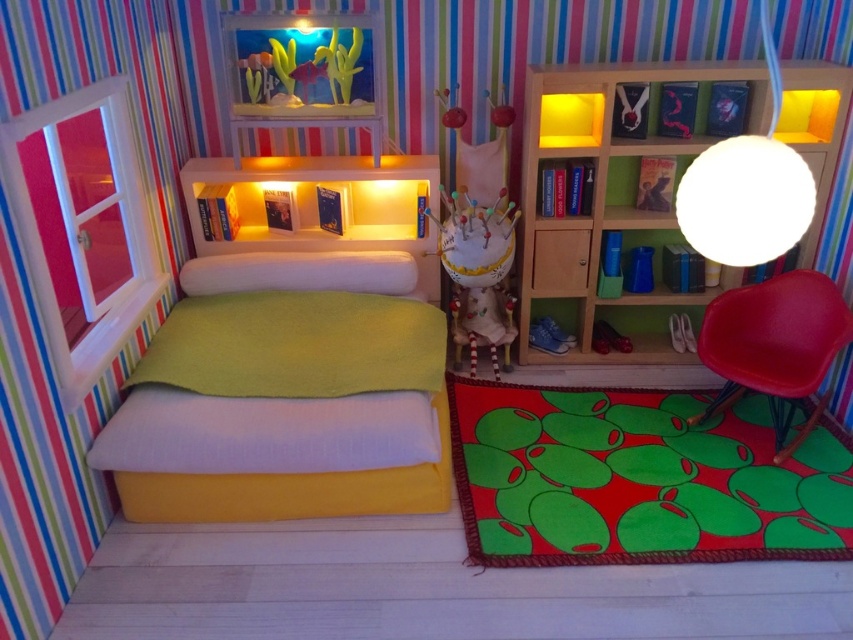
You are a small toy measuring 1.5 meters in length that needs to move from the matte red chair at lower right to the soft white pillow at center. Based on the scene, can you fit through the space between them?

The distance between the matte red chair at lower right and the soft white pillow at center is 1.73 meters. Since the toy is 1.5 meters long, it can fit through the space as the distance is greater than the toy length.

You are a tiny explorer in this miniature bedroom. You see the white matte globe at upper right and the white fabric doll at center. Which object is positioned more to the right side of the room?

The white matte globe at upper right is positioned more to the right side of the room compared to the white fabric doll at center.